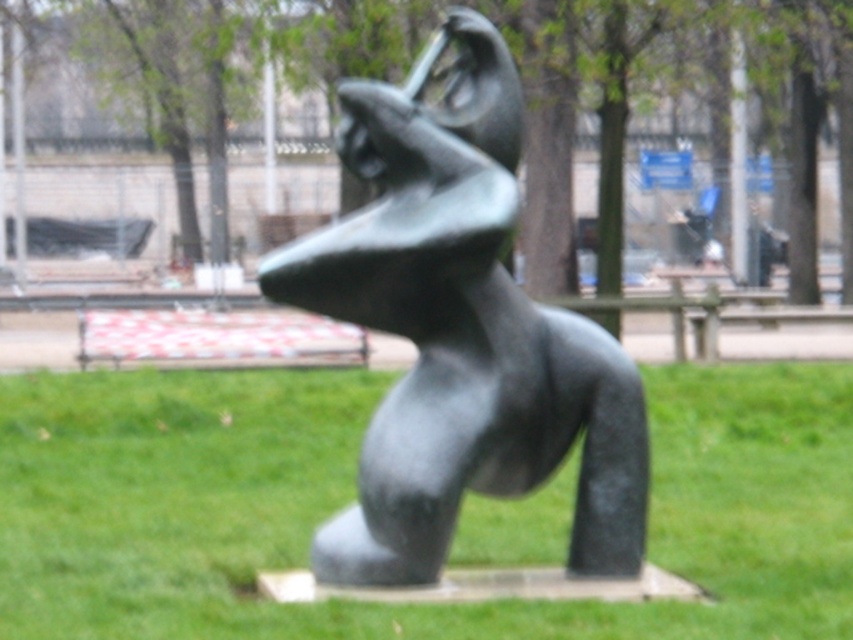
Looking at this image, between green grass at center and bronze sculpture at center, which one is positioned lower?

Result: green grass at center is below.

Can you confirm if green grass at center is bigger than bronze sculpture at center?

Correct, green grass at center is larger in size than bronze sculpture at center.

Identify the location of green grass at center. The width and height of the screenshot is (853, 640). (354, 496).

Locate an element on the screen. green grass at center is located at coordinates (354, 496).